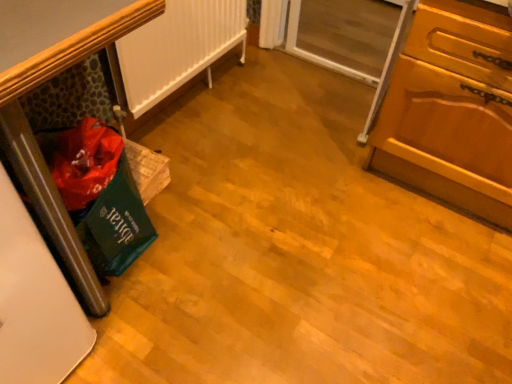
You are a GUI agent. You are given a task and a screenshot of the screen. Output one action in this format:
    pyautogui.click(x=<x>, y=<y>)
    Task: Click on the empty space that is in between green fabric bag at left and white matte radiator at left
    Image resolution: width=512 pixels, height=384 pixels.
    Given the screenshot: What is the action you would take?
    pyautogui.click(x=196, y=132)